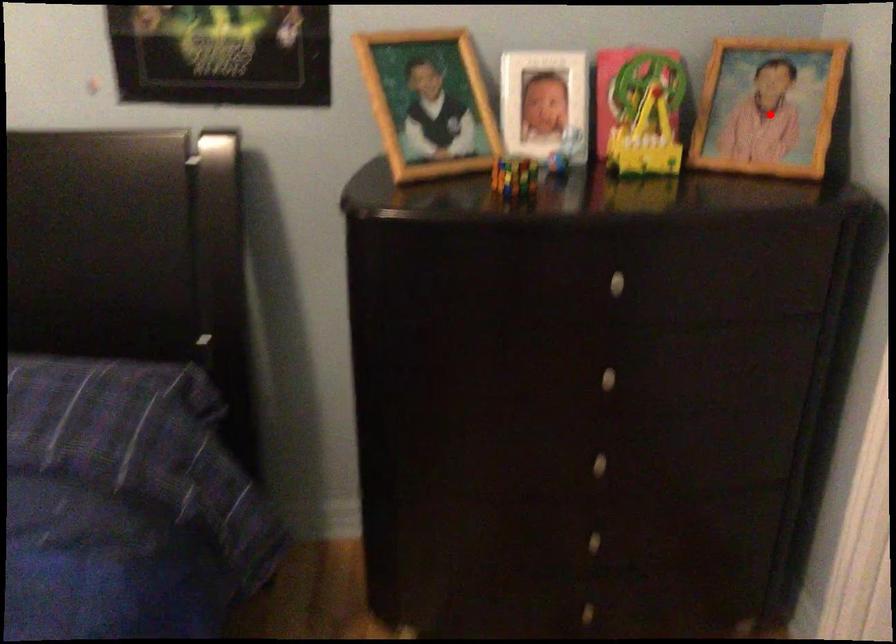
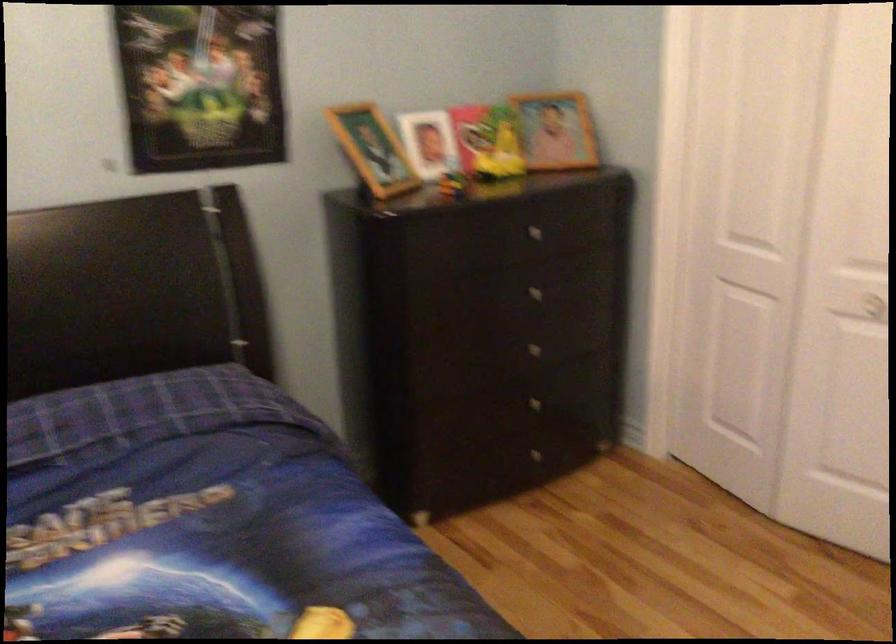
Where in the second image is the point corresponding to the highlighted location from the first image?

(556, 129)